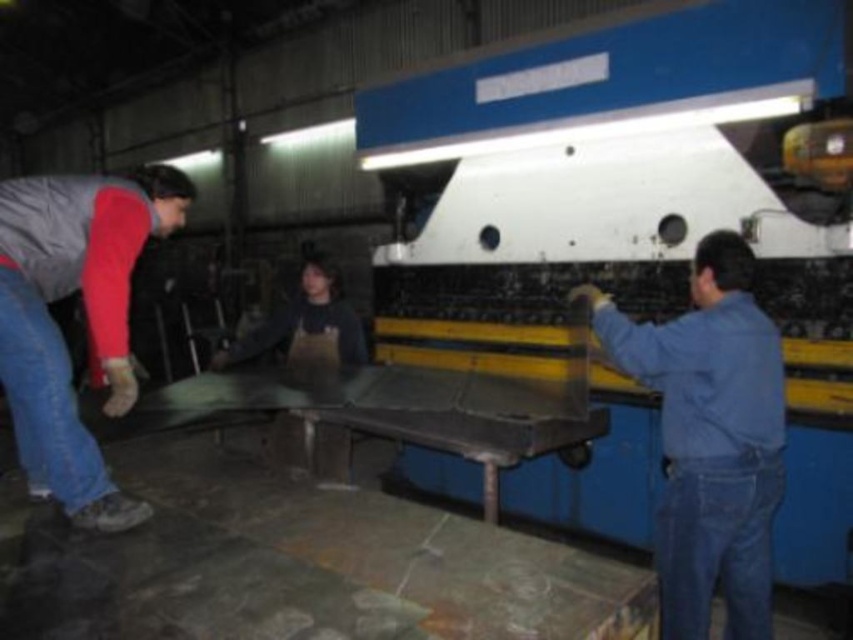
You are standing in the workshop and need to locate the denim at right and the blue denim jeans at lower left. Which of these items is closer to you?

The denim at right is closer to you because it is further to the viewer than the blue denim jeans at lower left.

You are standing at the origin point of the coordinate system in the workshop. You see a blue denim jumpsuit at right located at point (x=711, y=438). If you move 0.2 units to the right along the x axis, will you be closer to the blue denim jumpsuit at right?

Moving 0.2 units to the right along the x axis from the origin point would bring you closer to the blue denim jumpsuit at right located at point (x=711, y=438), since the x coordinate of the jumpsuit is greater than 0.2.

You are an observer in the workshop. You notice two people wearing blue denim clothing. The first person is wearing blue denim jeans at lower left, and the second is wearing blue denim jumpsuit at right. Which person is standing more to your right side?

The blue denim jumpsuit at right is positioned on the right side of blue denim jeans at lower left, so the person in the blue denim jumpsuit at right is standing more to your right side.